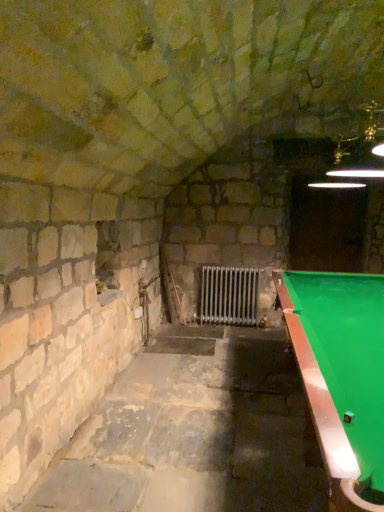
Question: Based on their positions, is green felt pool table at right located to the left or right of metallic silver radiator at center?

Choices:
 (A) left
 (B) right

Answer: (B)

Question: Is green felt pool table at right situated inside metallic silver radiator at center or outside?

Choices:
 (A) inside
 (B) outside

Answer: (B)

Question: Considering the positions of point tap(379, 312) and point tap(205, 278), is point tap(379, 312) closer or farther from the camera than point tap(205, 278)?

Choices:
 (A) farther
 (B) closer

Answer: (B)

Question: Is point (253, 298) positioned closer to the camera than point (304, 314)?

Choices:
 (A) closer
 (B) farther

Answer: (B)

Question: From the image's perspective, is metallic silver radiator at center above or below green felt pool table at right?

Choices:
 (A) above
 (B) below

Answer: (A)

Question: In the image, is metallic silver radiator at center positioned in front of or behind green felt pool table at right?

Choices:
 (A) behind
 (B) front

Answer: (A)

Question: Is metallic silver radiator at center bigger or smaller than green felt pool table at right?

Choices:
 (A) small
 (B) big

Answer: (A)